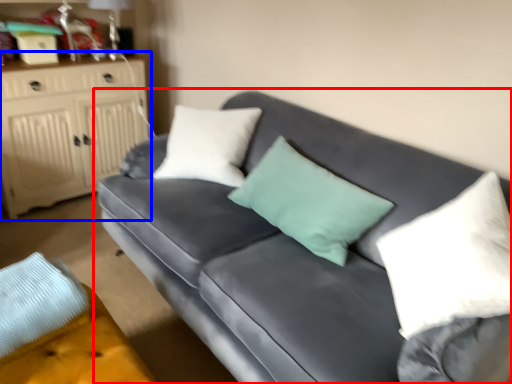
Question: Which object appears farthest to the camera in this image, studio couch (highlighted by a red box) or cabinetry (highlighted by a blue box)?

Choices:
 (A) studio couch
 (B) cabinetry

Answer: (B)